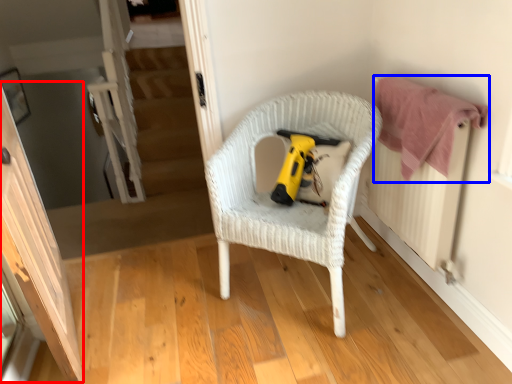
Question: Among these objects, which one is farthest to the camera, screen door (highlighted by a red box) or clothe (highlighted by a blue box)?

Choices:
 (A) screen door
 (B) clothe

Answer: (B)